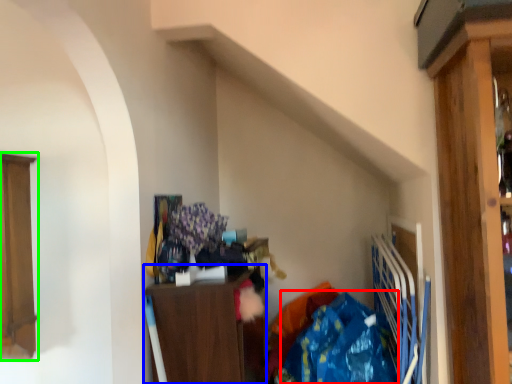
Question: Considering the real-world distances, which object is farthest from clothing (highlighted by a red box)? cabinetry (highlighted by a blue box) or cabinetry (highlighted by a green box)?

Choices:
 (A) cabinetry
 (B) cabinetry

Answer: (B)